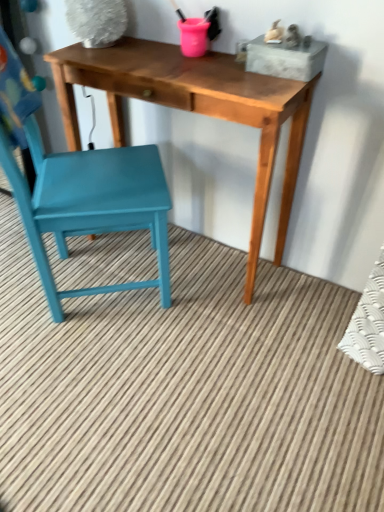
Question: Is teal painted wood chair at left wider than wooden table at center?

Choices:
 (A) yes
 (B) no

Answer: (A)

Question: From the image's perspective, would you say teal painted wood chair at left is shown under wooden table at center?

Choices:
 (A) no
 (B) yes

Answer: (B)

Question: Would you consider teal painted wood chair at left to be distant from wooden table at center?

Choices:
 (A) yes
 (B) no

Answer: (B)

Question: Is teal painted wood chair at left taller than wooden table at center?

Choices:
 (A) yes
 (B) no

Answer: (A)

Question: From a real-world perspective, is teal painted wood chair at left over wooden table at center?

Choices:
 (A) no
 (B) yes

Answer: (B)

Question: From a real-world perspective, does teal painted wood chair at left sit lower than wooden table at center?

Choices:
 (A) no
 (B) yes

Answer: (A)

Question: Is wooden table at center at the right side of teal painted wood chair at left?

Choices:
 (A) no
 (B) yes

Answer: (B)

Question: Considering the relative positions of wooden table at center and teal painted wood chair at left in the image provided, is wooden table at center behind teal painted wood chair at left?

Choices:
 (A) yes
 (B) no

Answer: (A)

Question: Does wooden table at center turn towards teal painted wood chair at left?

Choices:
 (A) yes
 (B) no

Answer: (A)

Question: Is wooden table at center positioned before teal painted wood chair at left?

Choices:
 (A) yes
 (B) no

Answer: (B)

Question: From the image's perspective, does wooden table at center appear higher than teal painted wood chair at left?

Choices:
 (A) no
 (B) yes

Answer: (B)

Question: Is teal painted wood chair at left inside wooden table at center?

Choices:
 (A) yes
 (B) no

Answer: (B)

Question: Is wooden table at center in front of or behind teal painted wood chair at left in the image?

Choices:
 (A) behind
 (B) front

Answer: (A)